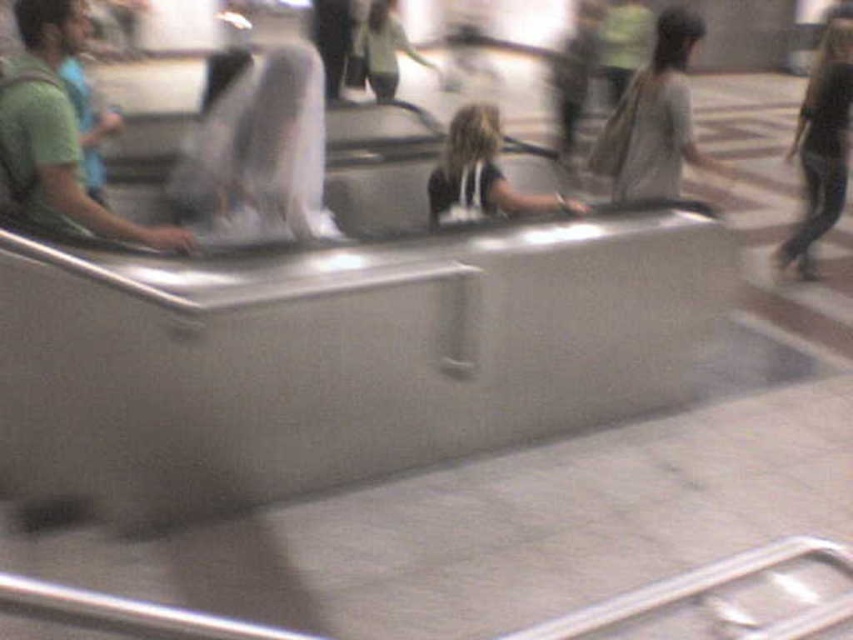
Question: Estimate the real-world distances between objects in this image. Which object is farther from the dark brown hair at center?

Choices:
 (A) gray fabric bag at right
 (B) light gray fabric jacket at upper center
 (C) dark blue jeans at right
 (D) green matte shirt at left

Answer: (B)

Question: Which point appears closest to the camera in this image?

Choices:
 (A) (674, 131)
 (B) (825, 70)
 (C) (456, 120)
 (D) (26, 150)

Answer: (D)

Question: In this image, where is green matte shirt at left located relative to dark blue jeans at right?

Choices:
 (A) above
 (B) below

Answer: (B)

Question: Which object is closer to the camera taking this photo?

Choices:
 (A) light gray fabric jacket at upper center
 (B) dark blue jeans at right
 (C) gray fabric bag at right

Answer: (C)

Question: Does dark brown hair at center lie in front of light gray fabric jacket at upper center?

Choices:
 (A) yes
 (B) no

Answer: (A)

Question: Observing the image, what is the correct spatial positioning of dark blue jeans at right in reference to dark brown hair at center?

Choices:
 (A) below
 (B) above

Answer: (B)